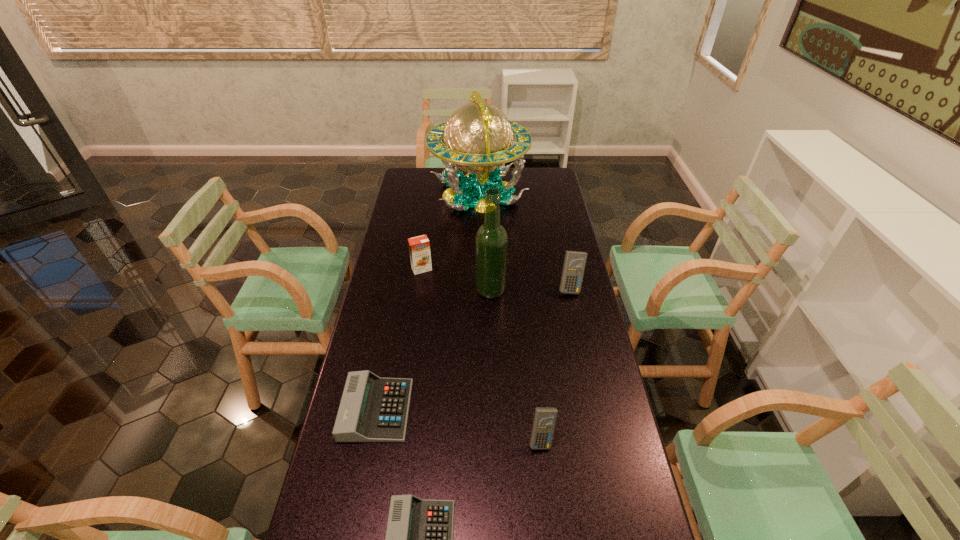
Find the location of a particular element. This screenshot has height=540, width=960. globe is located at coordinates (478, 137).

Image resolution: width=960 pixels, height=540 pixels. I want to click on liquor, so click(x=491, y=241).

I want to click on the rightmost object, so click(x=574, y=264).

This screenshot has width=960, height=540. In order to click on the tallest calculator in this screenshot , I will do `click(574, 264)`.

Find the location of `orange juice`. orange juice is located at coordinates [419, 247].

Find the location of a particular element. The image size is (960, 540). orange orange juice is located at coordinates (419, 247).

Where is `the left blue calculator`? Image resolution: width=960 pixels, height=540 pixels. the left blue calculator is located at coordinates (544, 421).

Identify the location of the third shortest object. The width and height of the screenshot is (960, 540). (544, 421).

The image size is (960, 540). Find the location of `the farther gray calculator`. the farther gray calculator is located at coordinates click(372, 409).

The image size is (960, 540). Identify the location of the second shortest object. (372, 409).